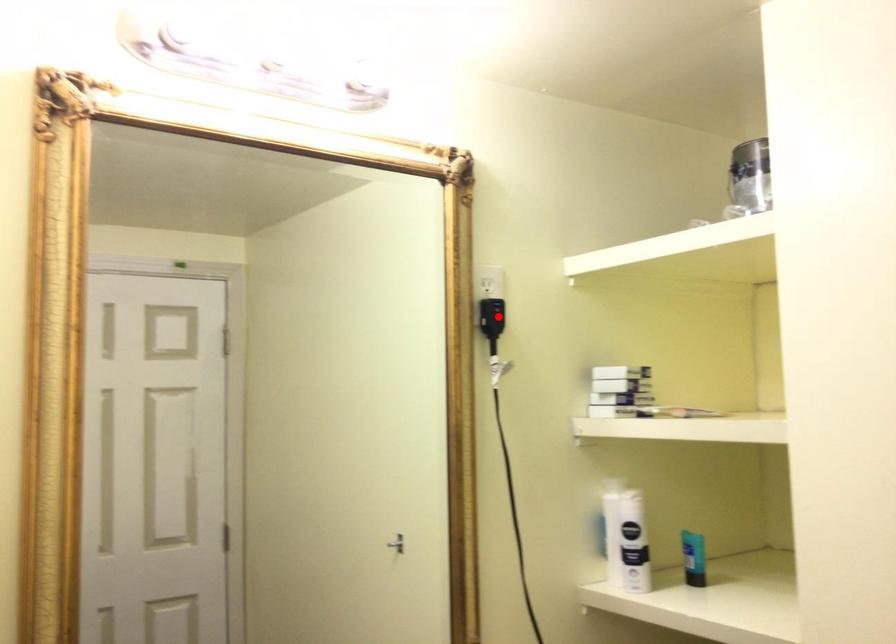
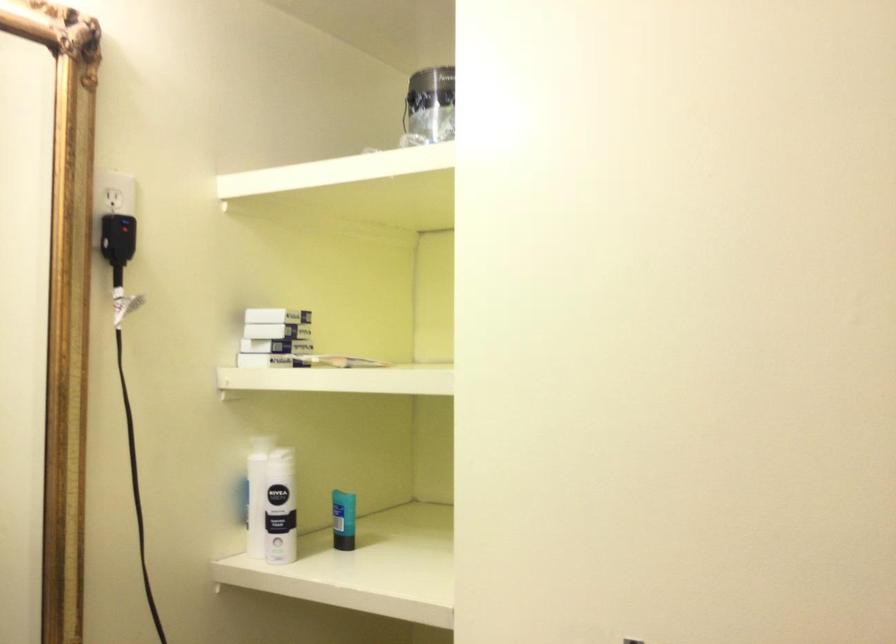
Locate, in the second image, the point that corresponds to the highlighted location in the first image.

(117, 238)